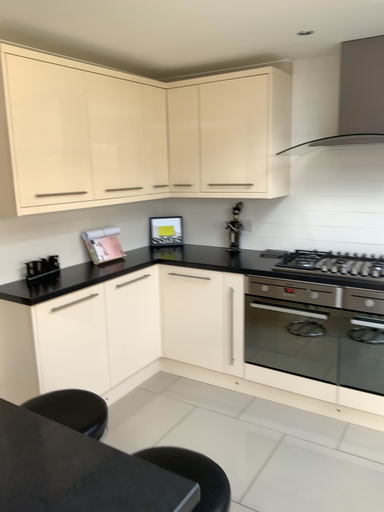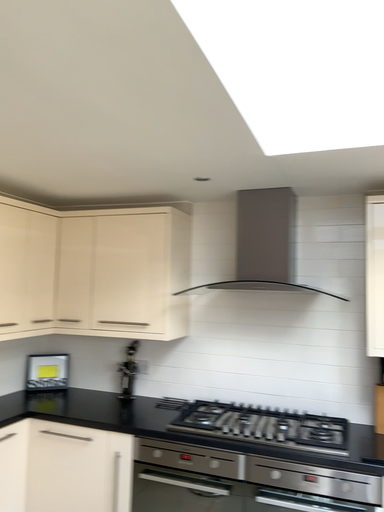
Question: Which way did the camera rotate in the video?

Choices:
 (A) rotated left
 (B) rotated right

Answer: (B)